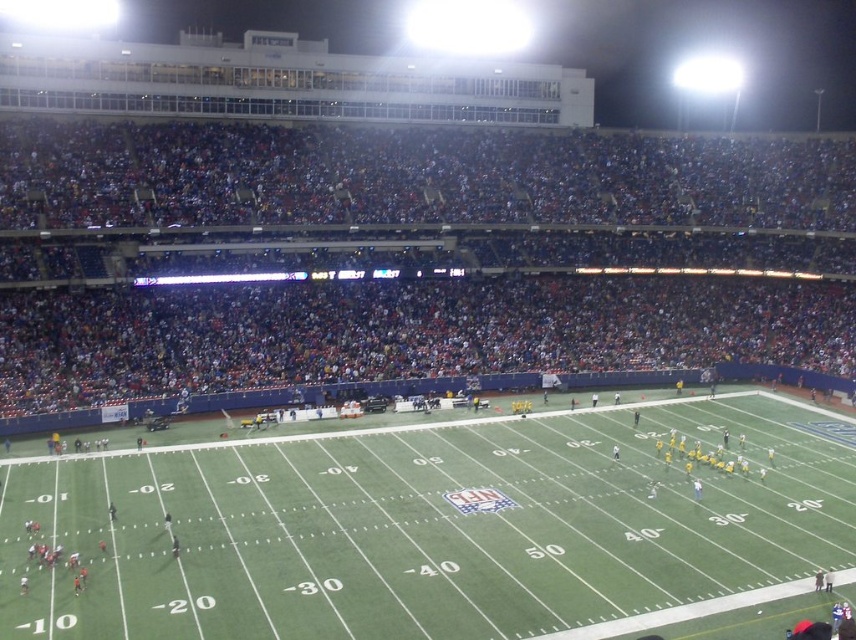
You are a drone operator trying to capture a live shot of the game. The stadium has a restricted airspace zone that prohibits drones from flying above the green turf football field at center. Given that your drone is currently at coordinates point A, which is at point A at point A, can you confirm if your drone is outside the restricted zone?

The green turf football field at center is located at point A at point A, so if your drone is currently at coordinates point A, it is exactly at the restricted zone. Please adjust your drone to ensure it stays outside the restricted airspace.

You are a photographer positioned at the edge of the field. You want to capture a photo that includes both the green turf football field at center and the dark blue seats at upper center. Based on their positions, which object should you frame first to ensure both are in the shot?

Since the green turf football field at center is to the left of the dark blue seats at upper center, you should frame the green turf football field at center first as it is positioned to the left, ensuring both objects are included in the shot.

You are a photographer standing at the edge of the field. You want to take a photo of the dark blue seats at upper center without the green turf football field at center blocking the view. Is this possible?

The green turf football field at center is in front of the dark blue seats at upper center, so taking a photo without the field blocking the view would require positioning yourself behind the field or adjusting the angle to avoid the obstruction.